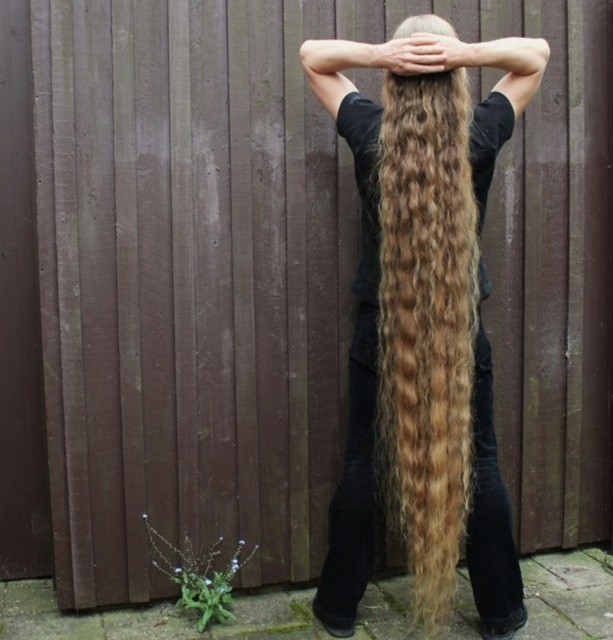
You are a photographer trying to capture the person in the scene. You want to ensure that both the golden wavy hair at back and the blonde curly hair at center are visible in the frame. Based on their positions, which hair should you focus on first to ensure both are in the shot?

The golden wavy hair at back is located below the blonde curly hair at center, so you should focus on the blonde curly hair at center first to ensure both are in the frame.

You are a photographer trying to capture the person in the scene. The golden wavy hair at center and blonde curly hair at center are both visible in the frame. Which hair is positioned lower on the person?

The golden wavy hair at center is below blonde curly hair at center, so the golden wavy hair at center is positioned lower on the person.

The person in the image has golden wavy hair at center and golden wavy hair at back. How far apart are these two sections of hair?

The golden wavy hair at center is 1.71 inches from golden wavy hair at back.